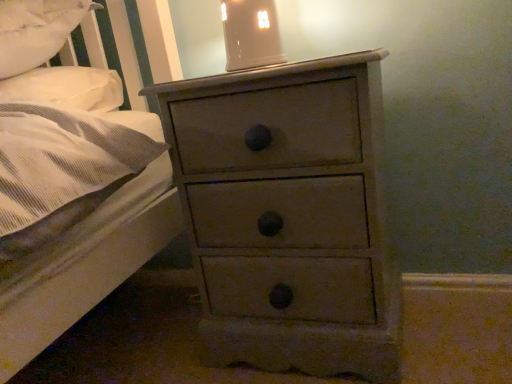
Question: Does matte ceramic lampshade at upper center have a greater height compared to distressed gray chest of drawers at center?

Choices:
 (A) no
 (B) yes

Answer: (A)

Question: Is matte ceramic lampshade at upper center located outside distressed gray chest of drawers at center?

Choices:
 (A) no
 (B) yes

Answer: (B)

Question: Does matte ceramic lampshade at upper center contain distressed gray chest of drawers at center?

Choices:
 (A) yes
 (B) no

Answer: (B)

Question: Is matte ceramic lampshade at upper center behind distressed gray chest of drawers at center?

Choices:
 (A) yes
 (B) no

Answer: (A)

Question: Considering the relative sizes of matte ceramic lampshade at upper center and distressed gray chest of drawers at center in the image provided, is matte ceramic lampshade at upper center bigger than distressed gray chest of drawers at center?

Choices:
 (A) yes
 (B) no

Answer: (B)

Question: Are matte ceramic lampshade at upper center and distressed gray chest of drawers at center located far from each other?

Choices:
 (A) yes
 (B) no

Answer: (B)

Question: Are white soft pillow at upper left and distressed gray chest of drawers at center making contact?

Choices:
 (A) yes
 (B) no

Answer: (B)

Question: Is white soft pillow at upper left oriented towards distressed gray chest of drawers at center?

Choices:
 (A) yes
 (B) no

Answer: (B)

Question: From the image's perspective, is white soft pillow at upper left located beneath distressed gray chest of drawers at center?

Choices:
 (A) yes
 (B) no

Answer: (B)

Question: From a real-world perspective, is white soft pillow at upper left positioned under distressed gray chest of drawers at center based on gravity?

Choices:
 (A) yes
 (B) no

Answer: (B)

Question: Would you say white soft pillow at upper left is outside distressed gray chest of drawers at center?

Choices:
 (A) no
 (B) yes

Answer: (B)

Question: From a real-world perspective, is white soft pillow at upper left located higher than distressed gray chest of drawers at center?

Choices:
 (A) yes
 (B) no

Answer: (A)

Question: From the image's perspective, is matte ceramic lampshade at upper center beneath white soft pillow at upper left?

Choices:
 (A) yes
 (B) no

Answer: (B)